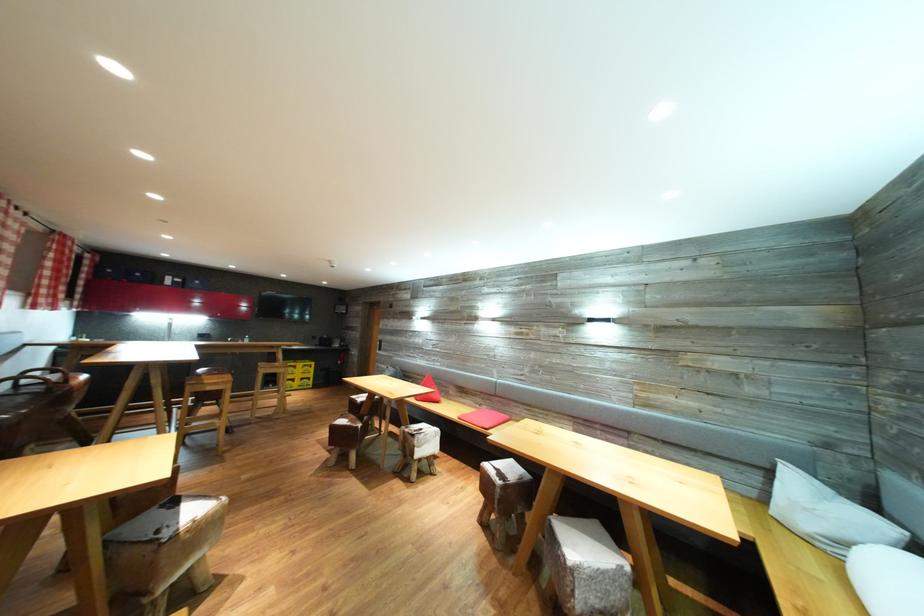
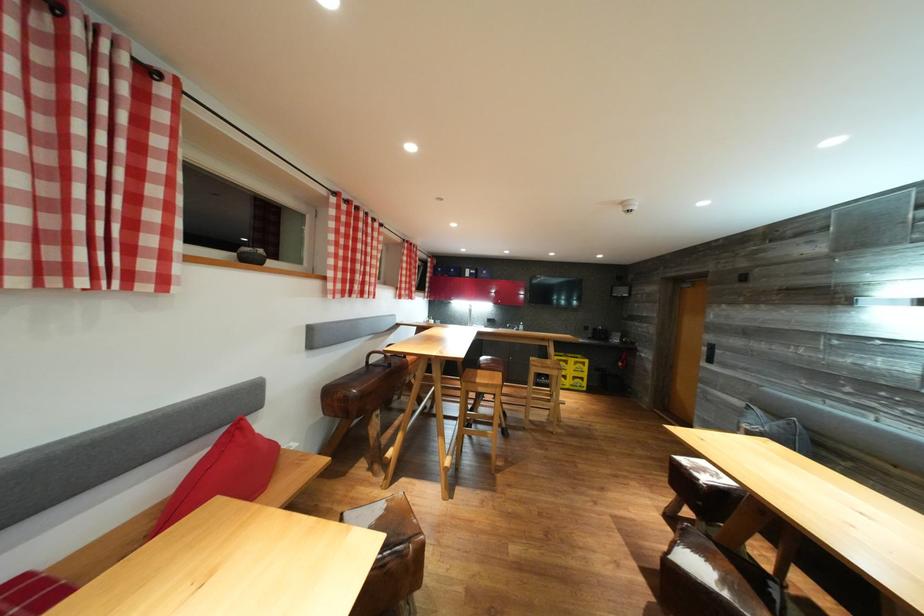
Where in the second image is the point corresponding to [307,370] from the first image?

(578, 366)